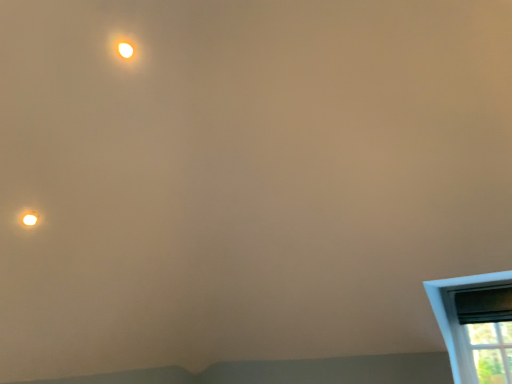
Question: Is matte white droplight at upper left oriented towards matte white light at upper left?

Choices:
 (A) no
 (B) yes

Answer: (A)

Question: Can matte white light at upper left be found inside matte white droplight at upper left?

Choices:
 (A) yes
 (B) no

Answer: (B)

Question: From a real-world perspective, is matte white droplight at upper left positioned under matte white light at upper left based on gravity?

Choices:
 (A) yes
 (B) no

Answer: (A)

Question: From a real-world perspective, is matte white droplight at upper left on matte white light at upper left?

Choices:
 (A) yes
 (B) no

Answer: (B)

Question: Does matte white droplight at upper left lie in front of matte white light at upper left?

Choices:
 (A) yes
 (B) no

Answer: (B)

Question: Considering the positions of point (119, 39) and point (505, 321), is point (119, 39) closer or farther from the camera than point (505, 321)?

Choices:
 (A) farther
 (B) closer

Answer: (B)

Question: Would you say matte white light at upper left is to the left or to the right of black plastic window screen at lower right in the picture?

Choices:
 (A) left
 (B) right

Answer: (A)

Question: Relative to black plastic window screen at lower right, is matte white light at upper left in front or behind?

Choices:
 (A) front
 (B) behind

Answer: (A)

Question: In terms of height, does matte white light at upper left look taller or shorter compared to black plastic window screen at lower right?

Choices:
 (A) tall
 (B) short

Answer: (B)

Question: Is matte white light at upper left to the left or to the right of matte white droplight at upper left in the image?

Choices:
 (A) left
 (B) right

Answer: (B)

Question: In terms of width, does matte white light at upper left look wider or thinner when compared to matte white droplight at upper left?

Choices:
 (A) thin
 (B) wide

Answer: (A)

Question: Looking at the image, does matte white light at upper left seem bigger or smaller compared to matte white droplight at upper left?

Choices:
 (A) big
 (B) small

Answer: (A)

Question: From the image's perspective, is matte white light at upper left above or below matte white droplight at upper left?

Choices:
 (A) above
 (B) below

Answer: (A)

Question: Is point (506, 289) closer or farther from the camera than point (121, 46)?

Choices:
 (A) farther
 (B) closer

Answer: (A)

Question: From a real-world perspective, is black plastic window screen at lower right above or below matte white light at upper left?

Choices:
 (A) below
 (B) above

Answer: (A)